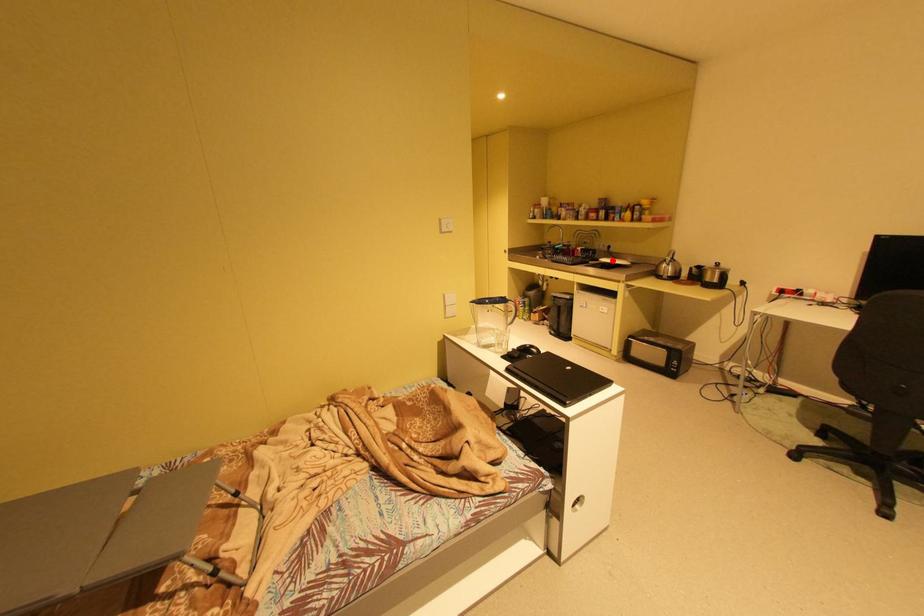
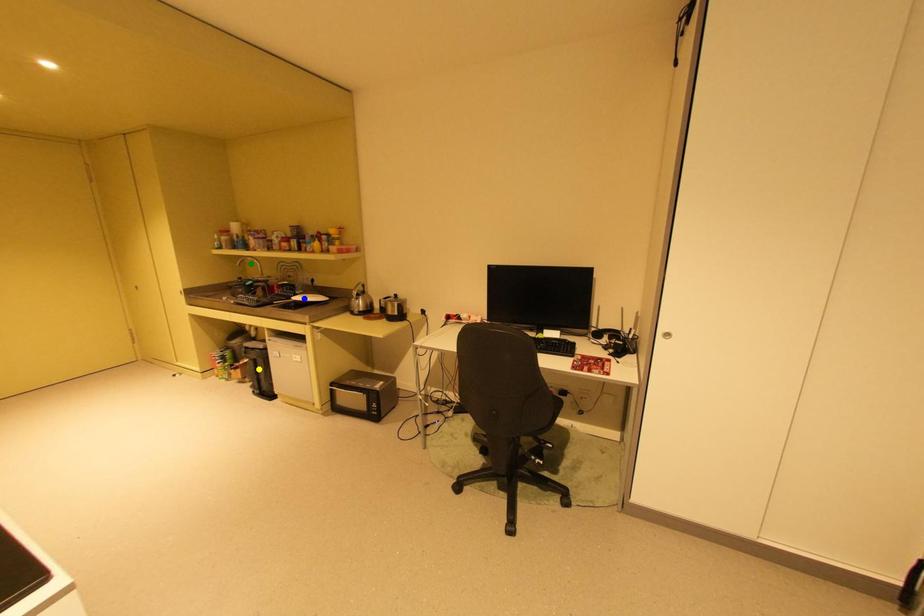
Question: I am providing you with two images of the same scene from different viewpoints. A red point is marked on the first image. You are given multiple points on the second image. Which mark in image 2 goes with the point in image 1?

Choices:
 (A) yellow point
 (B) blue point
 (C) green point

Answer: (B)